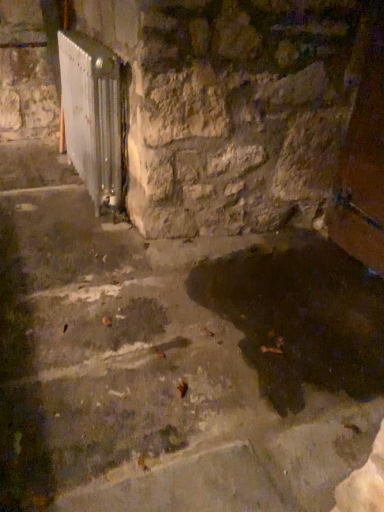
Identify the location of white metallic radiator at left. The height and width of the screenshot is (512, 384). 92,115.

What do you see at coordinates (92, 115) in the screenshot? I see `white metallic radiator at left` at bounding box center [92, 115].

Where is `white metallic radiator at left`? The width and height of the screenshot is (384, 512). white metallic radiator at left is located at coordinates (92, 115).